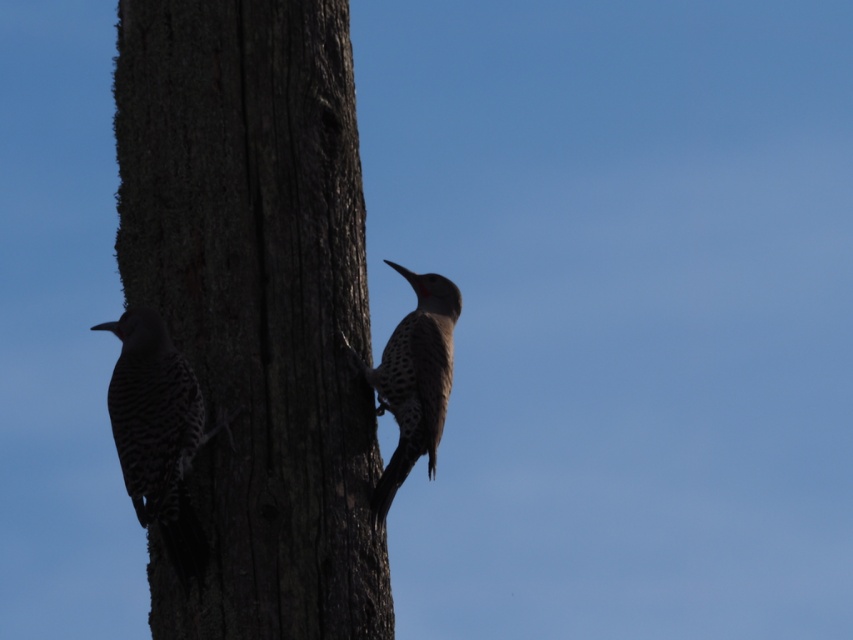
You are a birdwatcher observing the scene. You notice the smooth bark tree trunk at center and the speckled brown woodpecker at left. Which object is located higher up on the tree trunk?

The smooth bark tree trunk at center is positioned over the speckled brown woodpecker at left, so the smooth bark tree trunk at center is higher up on the tree trunk.

You are a birdwatcher trying to locate the smooth bark tree trunk at center. Using the coordinates provided, can you determine if it is positioned closer to the top or bottom of the image?

The smooth bark tree trunk at center is located at point coordinates with a y value of 0.301. Since the y coordinate ranges from 0 at the bottom to 1 at the top, a value of 0.301 indicates it is closer to the bottom of the image.

You are a birdwatcher trying to identify the larger woodpecker between the speckled brown woodpecker at left and the spotted feathered woodpecker at center. Based on their positions and sizes, which one is wider?

The speckled brown woodpecker at left is wider than the spotted feathered woodpecker at center because its width surpasses the other.